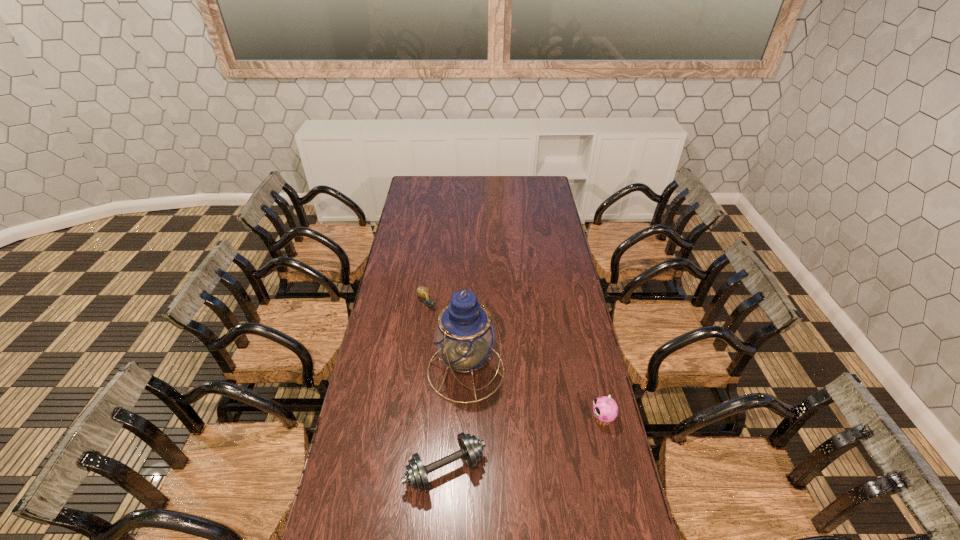
Identify the location of vacant area situated on the face of the rightmost object. (528, 418).

Where is `free space located 0.180m on the face of the rightmost object`? The height and width of the screenshot is (540, 960). free space located 0.180m on the face of the rightmost object is located at coordinates pyautogui.click(x=540, y=418).

The height and width of the screenshot is (540, 960). I want to click on vacant space situated 0.150m on the front-facing side of the farthest object, so click(x=450, y=332).

You are a GUI agent. You are given a task and a screenshot of the screen. Output one action in this format:
    pyautogui.click(x=<x>, y=<y>)
    Task: Click on the free spot located 0.100m on the front-facing side of the farthest object
    The image size is (960, 540).
    Given the screenshot: What is the action you would take?
    pyautogui.click(x=444, y=325)

Find the location of a particular element. The height and width of the screenshot is (540, 960). free point located 0.340m on the front-facing side of the farthest object is located at coordinates (475, 362).

Identify the location of vacant space located 0.290m on the front-facing side of the third nearest object. The image size is (960, 540). click(559, 444).

Where is `blank space located on the front-facing side of the third nearest object`? The image size is (960, 540). blank space located on the front-facing side of the third nearest object is located at coordinates (519, 413).

Identify the location of vacant point located 0.160m on the front-facing side of the third nearest object. The width and height of the screenshot is (960, 540). (529, 420).

In order to click on object that is at the right edge in this screenshot , I will do point(605,409).

In the image, there is a desktop. Where is `blank space at the far edge`? The image size is (960, 540). blank space at the far edge is located at coordinates (452, 193).